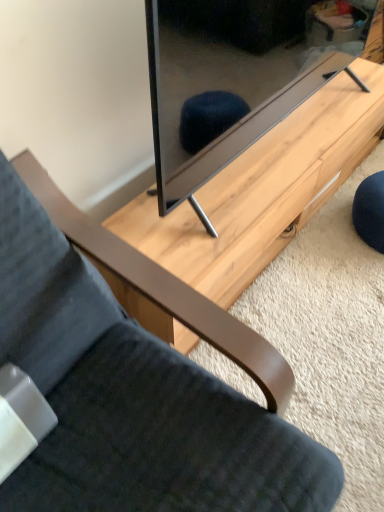
Image resolution: width=384 pixels, height=512 pixels. Identify the location of light wood table at center. (262, 191).

This screenshot has width=384, height=512. What are the coordinates of `velvet dark gray chair at lower left` in the screenshot? It's located at (131, 398).

At what (x,y) coordinates should I click in order to perform the action: click on matte black tv at center. Please return your answer as a coordinate pair (x, y). Looking at the image, I should click on (239, 76).

Can you confirm if velvet dark gray chair at lower left is bigger than light wood table at center?

Indeed, velvet dark gray chair at lower left has a larger size compared to light wood table at center.

Is velvet dark gray chair at lower left not close to light wood table at center?

velvet dark gray chair at lower left is actually quite close to light wood table at center.

Is point (46, 445) closer to viewer compared to point (151, 225)?

Yes.

Is velvet dark gray chair at lower left positioned in front of light wood table at center?

That is True.

The height and width of the screenshot is (512, 384). In order to click on table located behind the velvet dark gray chair at lower left in this screenshot , I will do [x=262, y=191].

In terms of height, does light wood table at center look taller or shorter compared to velvet dark gray chair at lower left?

Clearly, light wood table at center is shorter compared to velvet dark gray chair at lower left.

Does light wood table at center appear on the right side of velvet dark gray chair at lower left?

Correct, you'll find light wood table at center to the right of velvet dark gray chair at lower left.

Who is bigger, light wood table at center or velvet dark gray chair at lower left?

With larger size is velvet dark gray chair at lower left.

Which object is positioned more to the left, matte black tv at center or velvet dark gray chair at lower left?

Positioned to the left is velvet dark gray chair at lower left.

Does matte black tv at center have a lesser height compared to velvet dark gray chair at lower left?

Indeed, matte black tv at center has a lesser height compared to velvet dark gray chair at lower left.

Where is `chair on the left of the matte black tv at center`? The image size is (384, 512). chair on the left of the matte black tv at center is located at coordinates (131, 398).

Considering the relative sizes of matte black tv at center and velvet dark gray chair at lower left in the image provided, is matte black tv at center smaller than velvet dark gray chair at lower left?

Correct, matte black tv at center occupies less space than velvet dark gray chair at lower left.

Is light wood table at center facing away from matte black tv at center?

No.

Does light wood table at center have a greater width compared to matte black tv at center?

Correct, the width of light wood table at center exceeds that of matte black tv at center.

From a real-world perspective, which is physically above, light wood table at center or matte black tv at center?

matte black tv at center is physically above.

From the image's perspective, which is above, velvet dark gray chair at lower left or matte black tv at center?

matte black tv at center.

Which point is more distant from viewer, (105, 453) or (172, 16)?

Positioned behind is point (105, 453).

Does velvet dark gray chair at lower left appear on the right side of matte black tv at center?

In fact, velvet dark gray chair at lower left is to the left of matte black tv at center.

Can you confirm if velvet dark gray chair at lower left is taller than matte black tv at center?

Correct, velvet dark gray chair at lower left is much taller as matte black tv at center.

Considering the points (172, 106) and (284, 139), which point is behind, point (172, 106) or point (284, 139)?

Point (284, 139)

Is matte black tv at center oriented away from light wood table at center?

No, matte black tv at center's orientation is not away from light wood table at center.

Is light wood table at center a part of matte black tv at center?

No, light wood table at center is located outside of matte black tv at center.

Locate an element on the screen. The height and width of the screenshot is (512, 384). chair below the light wood table at center (from the image's perspective) is located at coordinates (131, 398).

At what (x,y) coordinates should I click in order to perform the action: click on chair above the light wood table at center (from a real-world perspective). Please return your answer as a coordinate pair (x, y). Looking at the image, I should click on (131, 398).

Which object lies further to the anchor point velvet dark gray chair at lower left, light wood table at center or matte black tv at center?

Based on the image, matte black tv at center appears to be further to velvet dark gray chair at lower left.

Based on their spatial positions, is velvet dark gray chair at lower left or light wood table at center further from matte black tv at center?

velvet dark gray chair at lower left is further to matte black tv at center.

Which object lies further to the anchor point light wood table at center, velvet dark gray chair at lower left or matte black tv at center?

Among the two, velvet dark gray chair at lower left is located further to light wood table at center.

From the image, which object appears to be nearer to light wood table at center, matte black tv at center or velvet dark gray chair at lower left?

The object closer to light wood table at center is matte black tv at center.

When comparing their distances from matte black tv at center, does light wood table at center or velvet dark gray chair at lower left seem further?

velvet dark gray chair at lower left is positioned further to the anchor matte black tv at center.

Looking at the image, which one is located closer to velvet dark gray chair at lower left, matte black tv at center or light wood table at center?

light wood table at center is positioned closer to the anchor velvet dark gray chair at lower left.

At what (x,y) coordinates should I click in order to perform the action: click on television between velvet dark gray chair at lower left and light wood table at center along the z-axis. Please return your answer as a coordinate pair (x, y). Image resolution: width=384 pixels, height=512 pixels. Looking at the image, I should click on [239, 76].